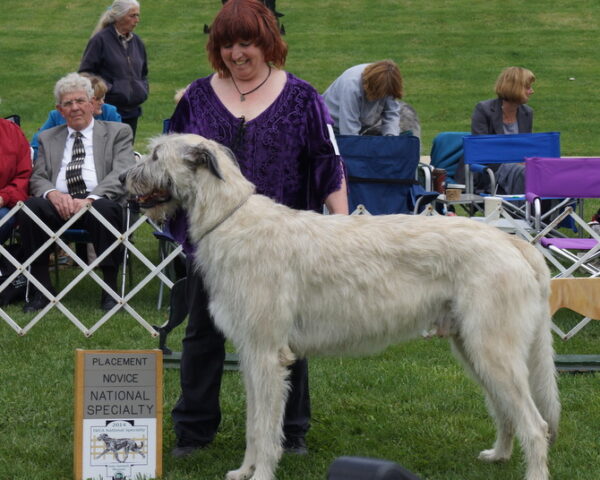
Locate an element on the screen. purple sitting chair is located at coordinates (575, 177).